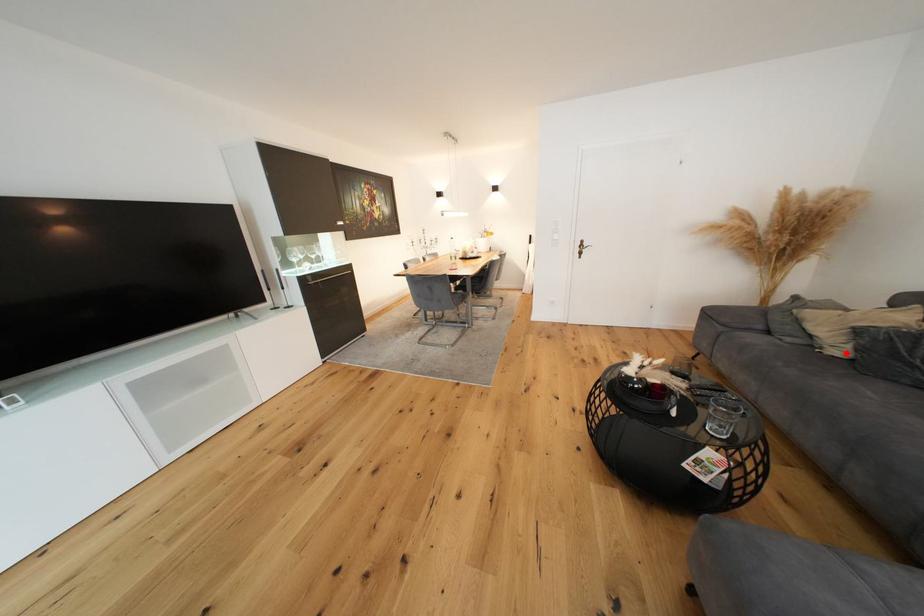
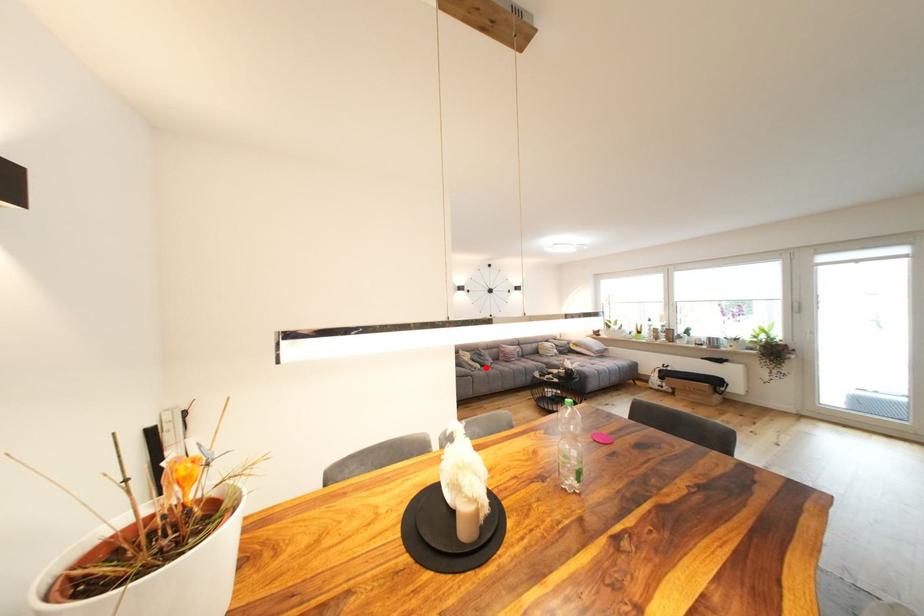
I am providing you with two images of the same scene from different viewpoints. A red point is marked on the first image and another point is marked on the second image. Is the red point in image1 aligned with the point shown in image2?

Yes